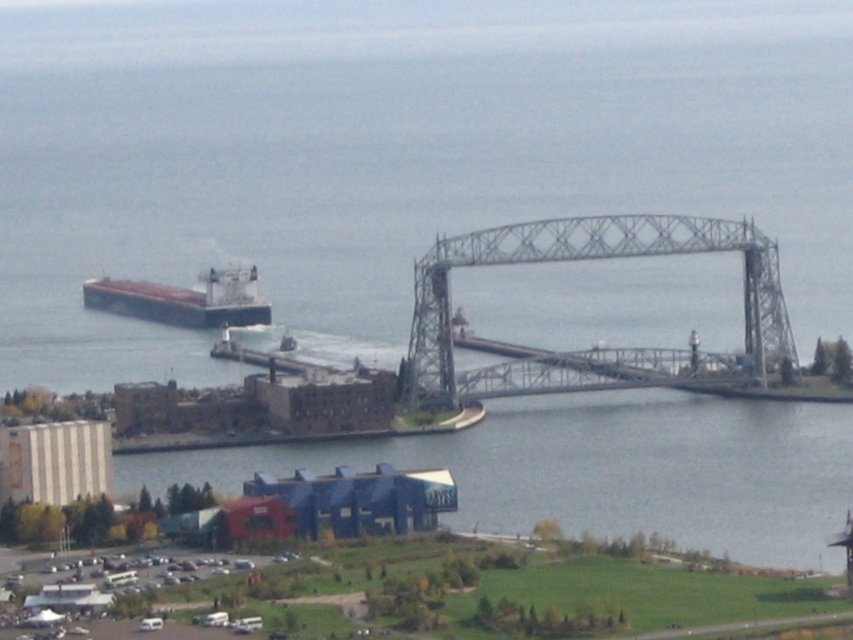
Between gray metallic bridge at center and brown matte cargo ship at left, which one has more height?

With more height is gray metallic bridge at center.

Can you confirm if gray metallic bridge at center is bigger than brown matte cargo ship at left?

Yes.

Between point (764, 273) and point (258, 305), which one is positioned in front?

Point (258, 305) is more forward.

Image resolution: width=853 pixels, height=640 pixels. I want to click on gray metallic bridge at center, so click(589, 259).